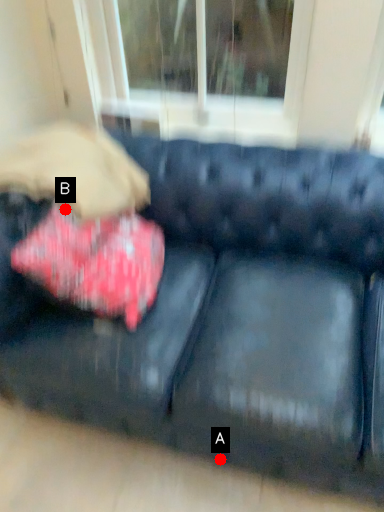
Question: Two points are circled on the image, labeled by A and B beside each circle. Which point appears closest to the camera in this image?

Choices:
 (A) A is closer
 (B) B is closer

Answer: (B)